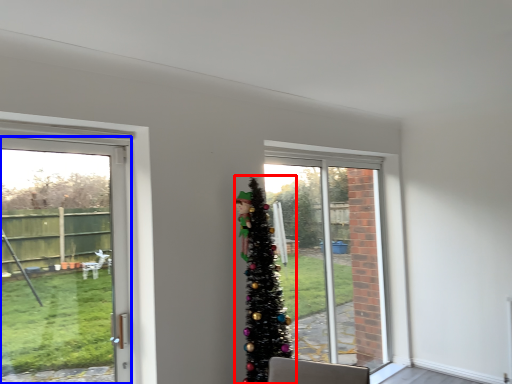
Question: Which point is closer to the camera, christmas tree (highlighted by a red box) or door (highlighted by a blue box)?

Choices:
 (A) christmas tree
 (B) door

Answer: (B)